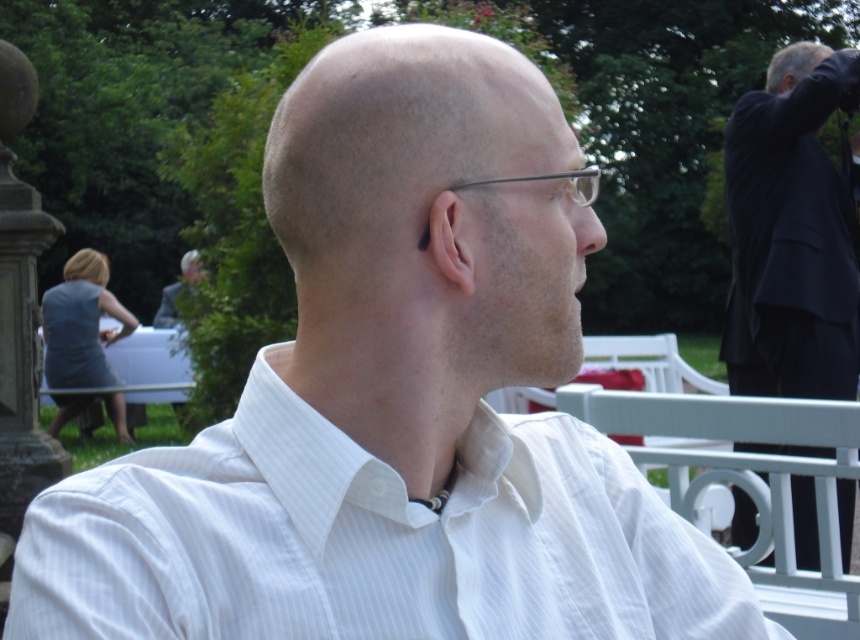
Question: Where is bald head at center located in relation to matte white hair at upper center in the image?

Choices:
 (A) below
 (B) above

Answer: (A)

Question: Among these points, which one is nearest to the camera?

Choices:
 (A) (187, 266)
 (B) (834, 209)
 (C) (389, 502)
 (D) (323, 186)

Answer: (C)

Question: Can you confirm if white striped dress shirt at center is thinner than dark suit at upper right?

Choices:
 (A) yes
 (B) no

Answer: (B)

Question: Considering the real-world distances, which object is closest to the metallic wireframe glasses at center?

Choices:
 (A) white striped dress shirt at center
 (B) skinny flesh-colored ear at center

Answer: (A)

Question: Can you confirm if bald head at center is wider than skinny flesh-colored ear at center?

Choices:
 (A) yes
 (B) no

Answer: (A)

Question: Which object is closer to the camera taking this photo?

Choices:
 (A) white striped dress shirt at center
 (B) metallic wireframe glasses at center
 (C) dark suit at upper right
 (D) matte white hair at upper center

Answer: (A)